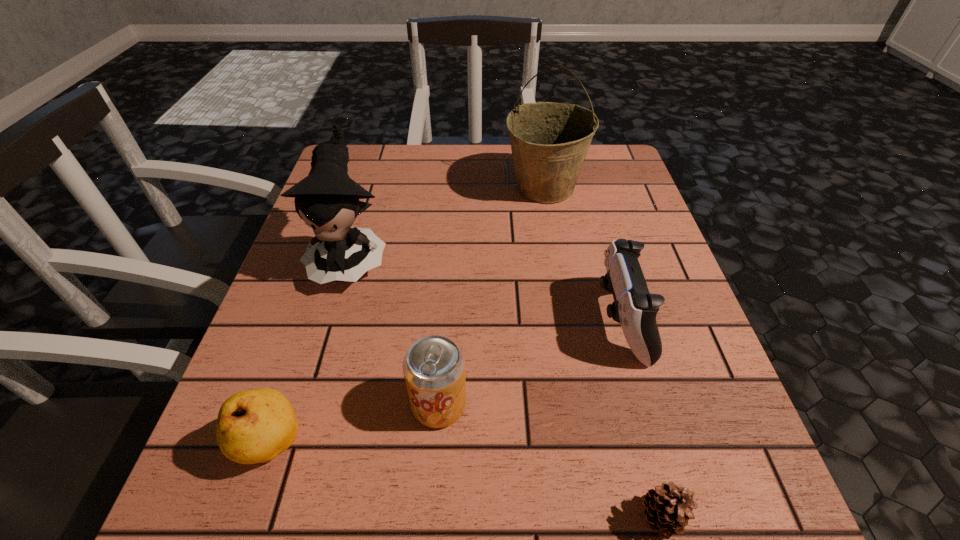
Find the location of a particular element. vacant space that is in between the control and the fifth shortest object is located at coordinates (486, 289).

You are a GUI agent. You are given a task and a screenshot of the screen. Output one action in this format:
    pyautogui.click(x=<x>, y=<y>)
    Task: Click on the vacant space that's between the farthest object and the control
    
    Given the screenshot: What is the action you would take?
    pyautogui.click(x=583, y=254)

Where is `vacant point located between the third object from left to right and the control`? Image resolution: width=960 pixels, height=540 pixels. vacant point located between the third object from left to right and the control is located at coordinates (530, 363).

Find the location of a particular element. This screenshot has width=960, height=540. object that stands as the third closest to the pear is located at coordinates (668, 508).

Identify which object is located as the third nearest to the farthest object. Please provide its 2D coordinates. Your answer should be formatted as a tuple, i.e. [(x, y)], where the tuple contains the x and y coordinates of a point satisfying the conditions above.

[(434, 367)]

Locate an element on the screen. This screenshot has width=960, height=540. free space in the image that satisfies the following two spatial constraints: 1. on the back side of the farthest object; 2. on the left side of the third object from left to right is located at coordinates (454, 187).

The image size is (960, 540). I want to click on free location that satisfies the following two spatial constraints: 1. on the front-facing side of the control; 2. on the front side of the pear, so click(656, 444).